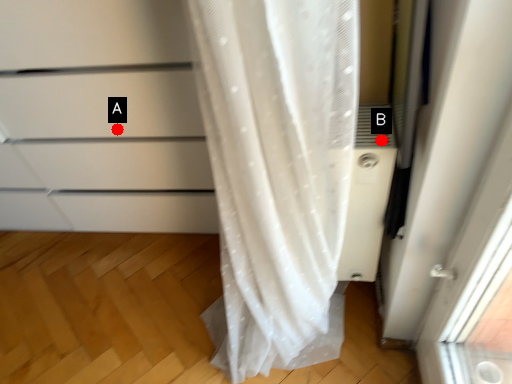
Question: Two points are circled on the image, labeled by A and B beside each circle. Which point is farther to the camera?

Choices:
 (A) A is further
 (B) B is further

Answer: (A)